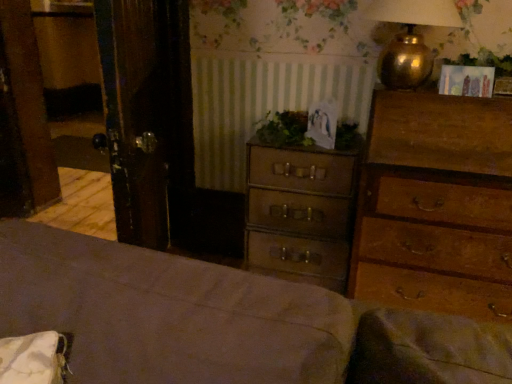
Question: From a real-world perspective, is brown wooden bed frame at lower left located beneath green leafy plant at upper right, the first plant from the right?

Choices:
 (A) yes
 (B) no

Answer: (A)

Question: Can green leafy plant at upper right, positioned as the first plant in top-to-bottom order, be found inside brown wooden bed frame at lower left?

Choices:
 (A) yes
 (B) no

Answer: (B)

Question: From the image's perspective, is brown wooden bed frame at lower left under green leafy plant at upper right, acting as the 2th plant starting from the bottom?

Choices:
 (A) yes
 (B) no

Answer: (A)

Question: Can you confirm if brown wooden bed frame at lower left is wider than green leafy plant at upper right, acting as the 2th plant starting from the bottom?

Choices:
 (A) no
 (B) yes

Answer: (B)

Question: Is brown wooden bed frame at lower left touching green leafy plant at upper right, positioned as the first plant in top-to-bottom order?

Choices:
 (A) no
 (B) yes

Answer: (A)

Question: Is brown wooden bed frame at lower left oriented away from green leafy plant at upper right, marked as the 2th plant in a left-to-right arrangement?

Choices:
 (A) no
 (B) yes

Answer: (B)

Question: Is there a large distance between wooden chest of drawers at right, which is counted as the 1th chest of drawers, starting from the right, and brown wooden bed frame at lower left?

Choices:
 (A) yes
 (B) no

Answer: (B)

Question: Can you confirm if wooden chest of drawers at right, which is counted as the 1th chest of drawers, starting from the right, is bigger than brown wooden bed frame at lower left?

Choices:
 (A) yes
 (B) no

Answer: (B)

Question: Is wooden chest of drawers at right, which is the 2th chest of drawers from left to right, closer to camera compared to brown wooden bed frame at lower left?

Choices:
 (A) yes
 (B) no

Answer: (B)

Question: Is wooden chest of drawers at right, which is counted as the 1th chest of drawers, starting from the right, thinner than brown wooden bed frame at lower left?

Choices:
 (A) no
 (B) yes

Answer: (B)

Question: Does wooden chest of drawers at right, which is counted as the 1th chest of drawers, starting from the right, have a greater height compared to brown wooden bed frame at lower left?

Choices:
 (A) no
 (B) yes

Answer: (B)

Question: Is brown wooden bed frame at lower left a part of wooden chest of drawers at right, which is counted as the 1th chest of drawers, starting from the right?

Choices:
 (A) yes
 (B) no

Answer: (B)

Question: Does gold metallic lamp at upper right turn towards green leafy plant at center, which is the 1th plant from left to right?

Choices:
 (A) no
 (B) yes

Answer: (A)